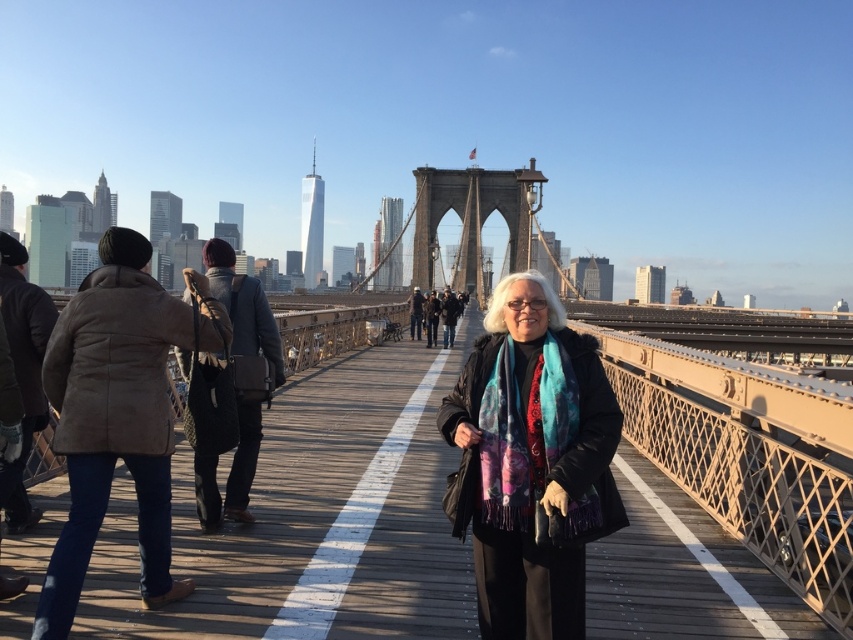
You are a photographer standing on the Brooklyn Bridge and want to take a photo that includes both the point at (490, 435) and the point at (65, 355). Which point should you focus on first to ensure both are in sharp focus?

You should focus on the point at (490, 435) first because it is closer to the camera than the point at (65, 355), ensuring both will be in focus when using a proper aperture setting.

You are standing at a point on the Brooklyn Bridge. A photographer wants you to move to a specific location so that you are exactly 88.90 meters away from the point marked as point (479, 364). Can you determine if moving forward or backward from your current position will get you closer to the desired distance?

The point (479, 364) is 88.90 meters away from the viewer. If you are currently at a position farther than 88.90 meters from point (479, 364), moving forward would decrease the distance, bringing you closer to the desired 88.90 meters. Conversely, if you are closer than 88.90 meters, moving backward would increase the distance toward the target. Without knowing your current distance, you can adjust direction based on whether you need to increase or decrease the distance to reach exactly 88.90 meters.

Based on the photo, you are a photographer trying to capture the woman on the Brooklyn Bridge. You notice the multicolored scarf at center and the brown fuzzy coat at left. Which item is closer to the camera?

The multicolored scarf at center is positioned under the brown fuzzy coat at left, meaning it is closer to the camera.